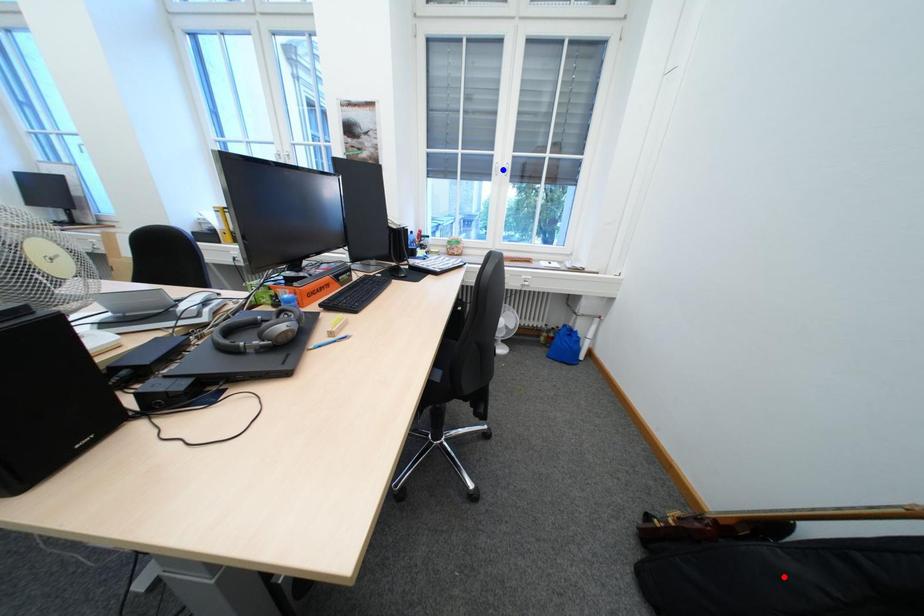
Question: In the image, two points are highlighted. Which point is nearer to the camera? Reply with the corresponding letter.

Choices:
 (A) blue point
 (B) red point

Answer: (B)